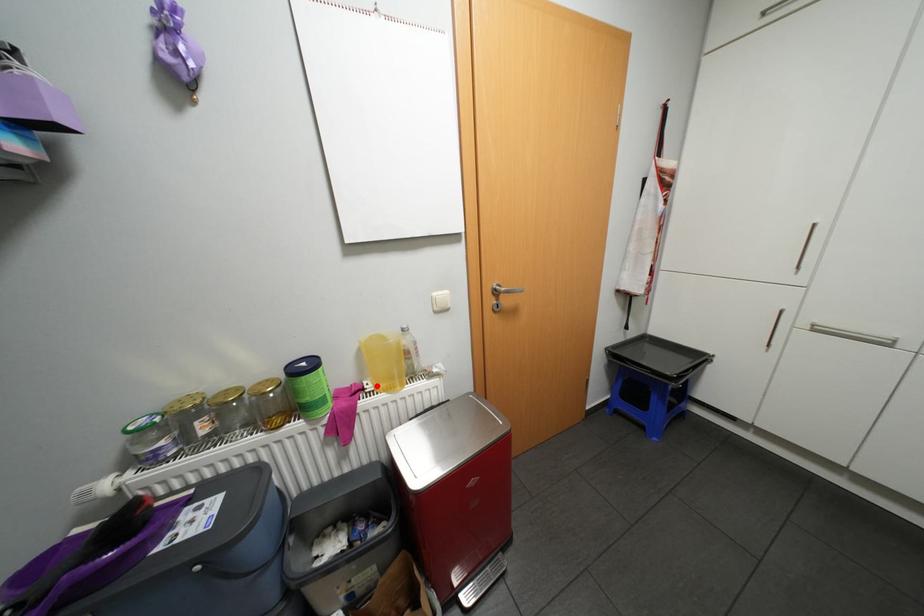
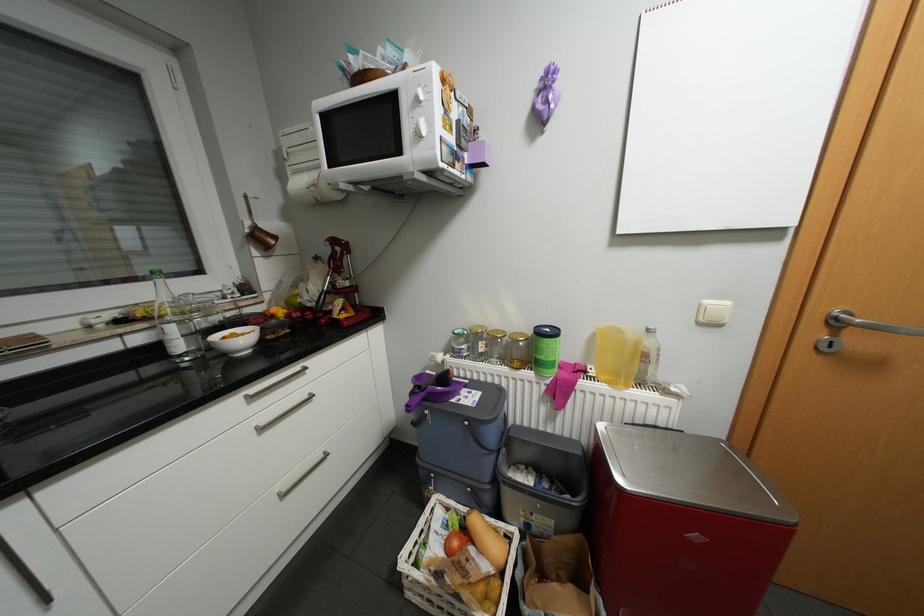
Find the pixel in the second image that matches the highlighted location in the first image.

(600, 371)